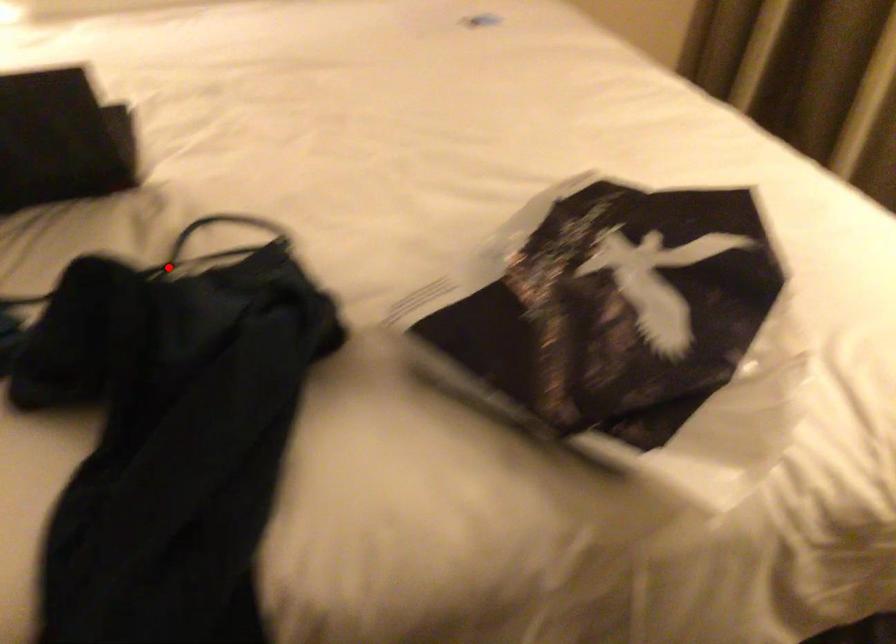
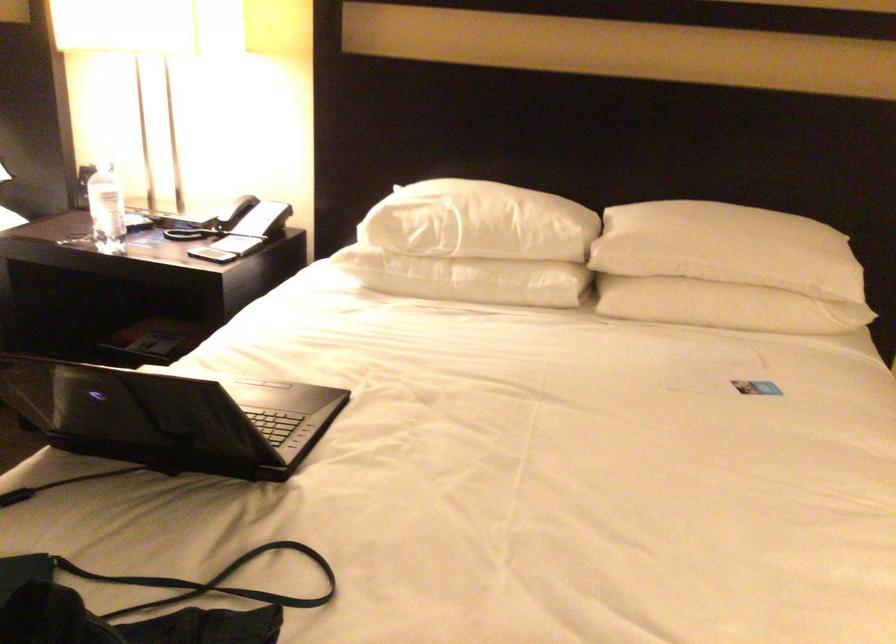
The point at the highlighted location is marked in the first image. Where is the corresponding point in the second image?

(211, 581)